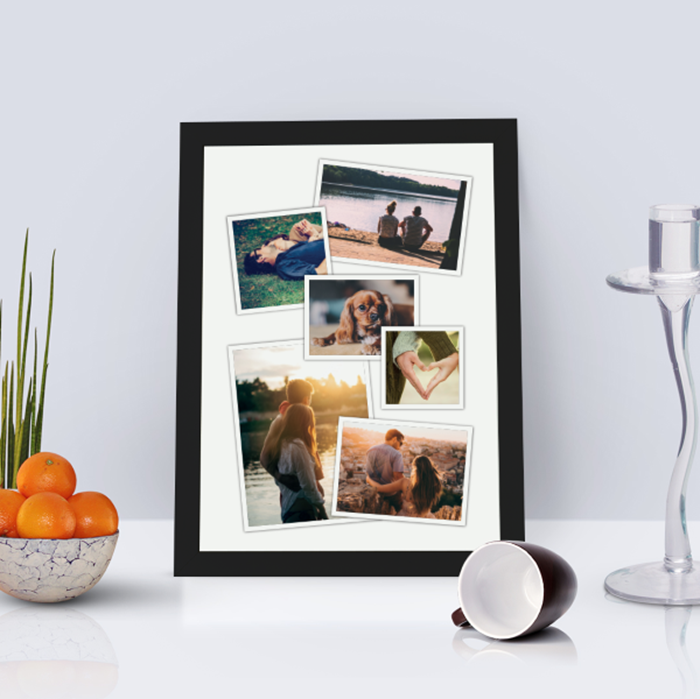
Locate an element on the screen. photos in collage is located at coordinates (258, 272), (376, 226), (371, 312), (405, 454), (295, 432).